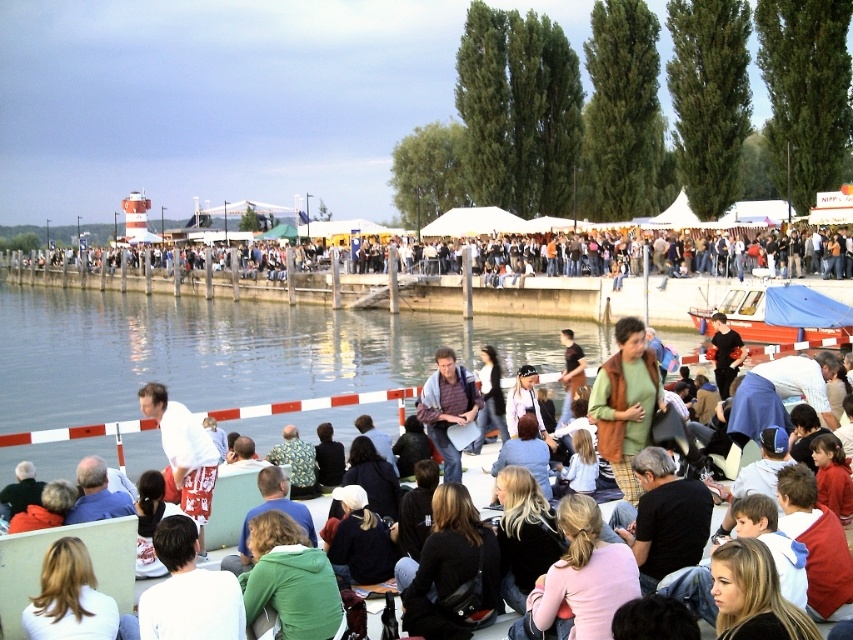
Based on the photo, is green fleece jacket at lower center positioned at the back of red plastic boat at center?

No.

Consider the image. Can you confirm if green fleece jacket at lower center is bigger than red plastic boat at center?

No, green fleece jacket at lower center is not bigger than red plastic boat at center.

Between point (288, 572) and point (741, 289), which one is positioned in front?

Point (288, 572) is more forward.

Where is `green fleece jacket at lower center`? green fleece jacket at lower center is located at coordinates (289, 579).

Is white tent at center closer to the viewer compared to blonde hair at lower left?

No, white tent at center is further to the viewer.

Based on the photo, between white tent at center and blonde hair at lower left, which one appears on the right side from the viewer's perspective?

From the viewer's perspective, blonde hair at lower left appears more on the right side.

Does point (808, 241) come behind point (103, 618)?

Yes, it is behind point (103, 618).

Image resolution: width=853 pixels, height=640 pixels. I want to click on white tent at center, so click(x=706, y=257).

Is green fabric jacket at center positioned in front of blonde hair at lower left?

No, green fabric jacket at center is behind blonde hair at lower left.

Is green fabric jacket at center shorter than blonde hair at lower left?

No.

Identify the location of green fabric jacket at center. (195, 353).

Identify the location of green fabric jacket at center. The image size is (853, 640). (195, 353).